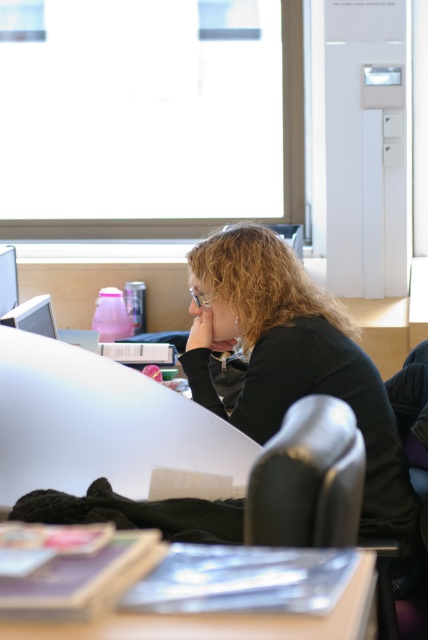
Question: Is white glossy desk at center closer to camera compared to matte plastic table at lower center?

Choices:
 (A) yes
 (B) no

Answer: (B)

Question: Is white glossy desk at center to the right of matte plastic table at lower center from the viewer's perspective?

Choices:
 (A) no
 (B) yes

Answer: (A)

Question: Can you confirm if black matte jacket at center is thinner than matte plastic table at lower center?

Choices:
 (A) no
 (B) yes

Answer: (A)

Question: Which object appears farthest from the camera in this image?

Choices:
 (A) white glossy desk at center
 (B) matte plastic table at lower center
 (C) black matte jacket at center

Answer: (C)

Question: Estimate the real-world distances between objects in this image. Which object is farther from the white glossy desk at center?

Choices:
 (A) black matte jacket at center
 (B) matte plastic table at lower center

Answer: (B)

Question: Which object is positioned closest to the matte plastic table at lower center?

Choices:
 (A) black matte jacket at center
 (B) white glossy desk at center

Answer: (B)